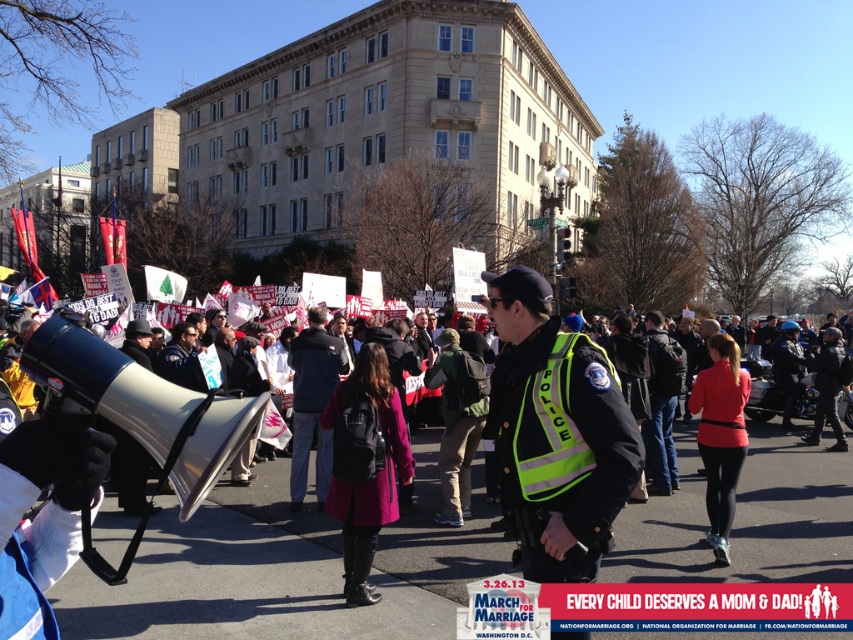
In the scene shown: What are the coordinates of the pink fabric coat at center?

The pink fabric coat at center is located at coordinates point (360, 467).

You are a photographer trying to capture a clear shot of both the neon yellow reflective vest at center and the red matte jacket at center from your position at the back of the crowd. Which object will appear bigger in your photo?

The neon yellow reflective vest at center will appear bigger in the photo because it is larger in size than the red matte jacket at center.